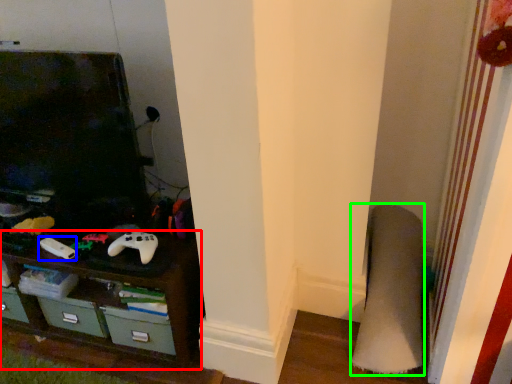
Question: Which object is the farthest from shelf (highlighted by a red box)? Choose among these: game controller (highlighted by a blue box) or plain (highlighted by a green box).

Choices:
 (A) game controller
 (B) plain

Answer: (B)